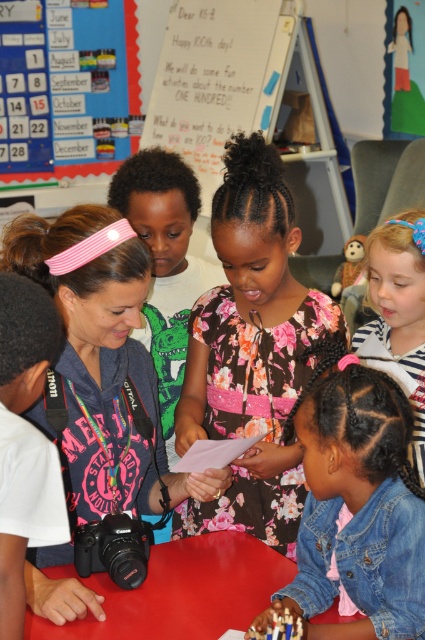
Question: Does denim jacket at lower right come in front of red plastic table at lower center?

Choices:
 (A) no
 (B) yes

Answer: (B)

Question: Estimate the real-world distances between objects in this image. Which object is closer to the pink fabric headband at center?

Choices:
 (A) denim jacket at lower right
 (B) blue paper calendar at upper left

Answer: (A)

Question: Is the position of denim jacket at lower right more distant than that of blue paper calendar at upper left?

Choices:
 (A) no
 (B) yes

Answer: (A)

Question: Which of the following is the farthest from the observer?

Choices:
 (A) blue paper calendar at upper left
 (B) red plastic table at lower center
 (C) blue striped shirt at lower right
 (D) pink fabric headband at center

Answer: (A)

Question: Is floral fabric dress at center smaller than blue striped shirt at lower right?

Choices:
 (A) no
 (B) yes

Answer: (A)

Question: Estimate the real-world distances between objects in this image. Which object is closer to the denim jacket at lower right?

Choices:
 (A) blue striped shirt at lower right
 (B) floral fabric dress at center
 (C) blue paper calendar at upper left
 (D) red plastic table at lower center

Answer: (D)